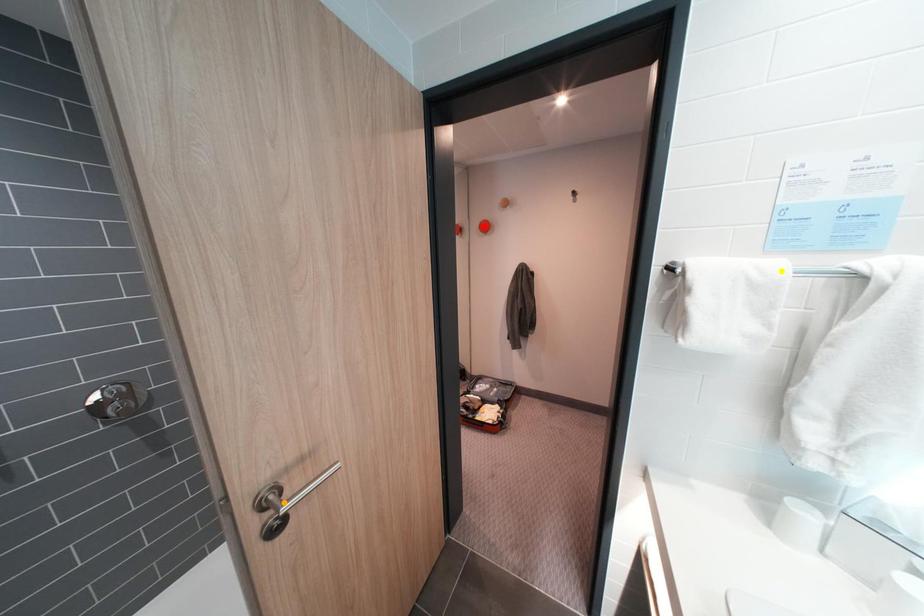
Order these from nearest to farthest:
yellow point, red point, orange point

yellow point, orange point, red point